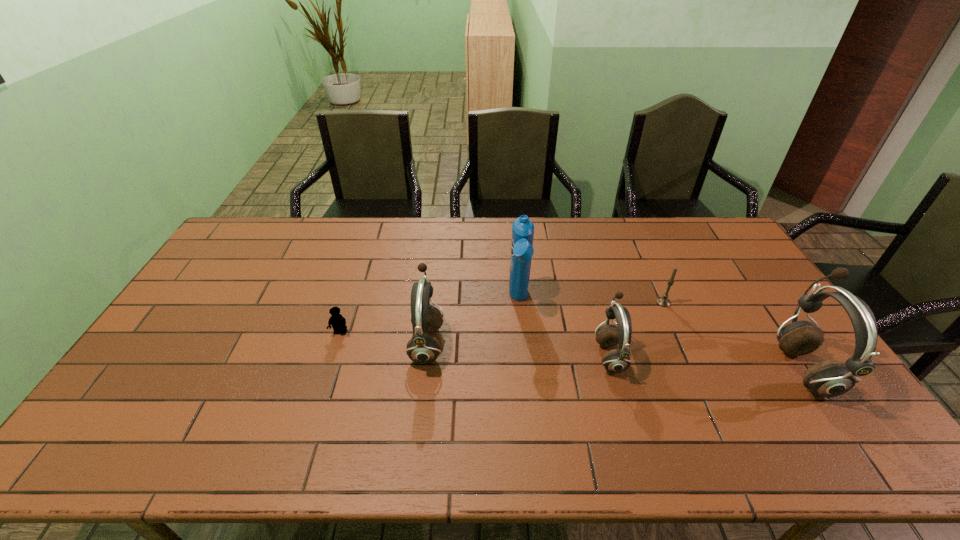
Locate which earphone is the second closest to the leftmost object. Please provide its 2D coordinates. Your answer should be formatted as a tuple, i.e. [(x, y)], where the tuple contains the x and y coordinates of a point satisfying the conditions above.

[(618, 360)]

You are a GUI agent. You are given a task and a screenshot of the screen. Output one action in this format:
    pyautogui.click(x=<x>, y=<y>)
    Task: Click on the earphone that stands as the third closest to the second shortest object
    Image resolution: width=960 pixels, height=540 pixels.
    Given the screenshot: What is the action you would take?
    pyautogui.click(x=422, y=348)